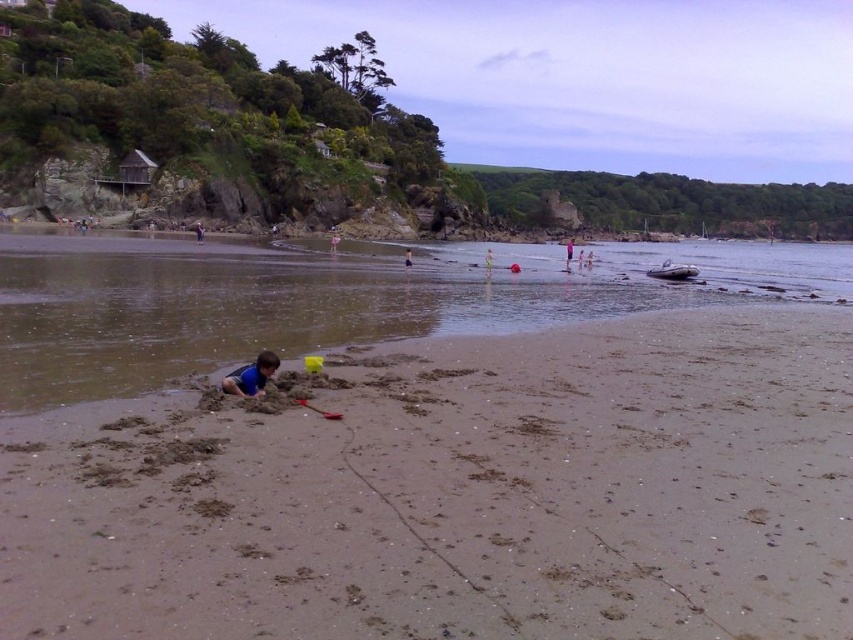
Can you confirm if blue fabric person at lower left is positioned to the left of green fabric shorts at center?

Yes, blue fabric person at lower left is to the left of green fabric shorts at center.

Where is `blue fabric person at lower left`? The width and height of the screenshot is (853, 640). blue fabric person at lower left is located at coordinates (334, 241).

The height and width of the screenshot is (640, 853). Identify the location of blue fabric person at lower left. (334, 241).

Is point (268, 321) less distant than point (331, 240)?

Yes, it is in front of point (331, 240).

Between point (83, 284) and point (331, 240), which one is positioned behind?

Point (331, 240)

Identify the location of brown sand at lower left. (331, 301).

Is blue fabric boy at lower left smaller than green fabric shorts at center?

Indeed, blue fabric boy at lower left has a smaller size compared to green fabric shorts at center.

Is blue fabric boy at lower left thinner than green fabric shorts at center?

Yes.

Is point (247, 381) positioned behind point (492, 257)?

No, it is in front of (492, 257).

This screenshot has width=853, height=640. Find the location of `blue fabric boy at lower left`. blue fabric boy at lower left is located at coordinates (251, 376).